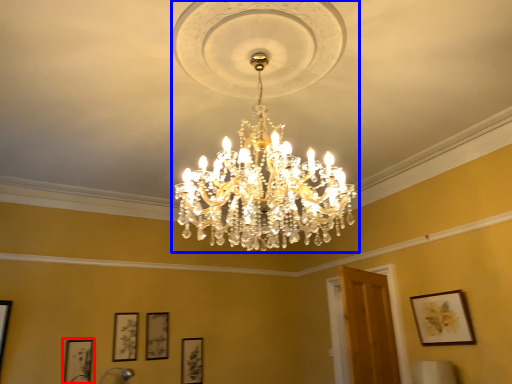
Question: Which object is further to the camera taking this photo, picture frame (highlighted by a red box) or lamp (highlighted by a blue box)?

Choices:
 (A) picture frame
 (B) lamp

Answer: (A)